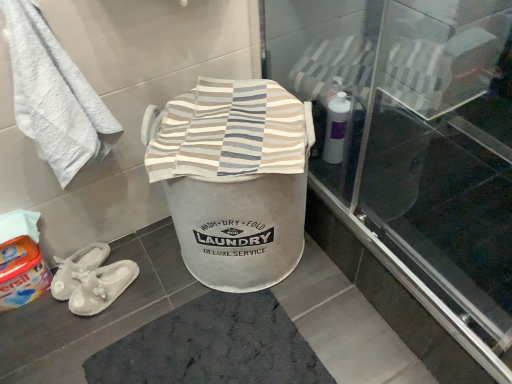
Find the location of a particular element. Image resolution: width=512 pixels, height=384 pixels. blank area to the left of white fabric laundry basket at center is located at coordinates (147, 273).